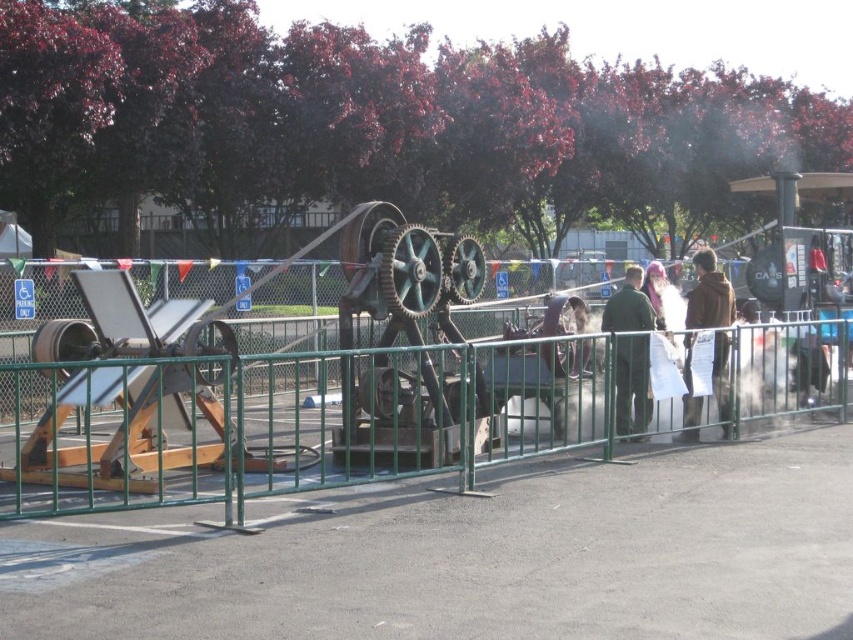
You are a photographer trying to capture a clear photo of the green matte jacket at center. However, the brown fuzzy coat at right is blocking your view. Can you move around to the left side to get an unobstructed shot?

The green matte jacket at center is behind the brown fuzzy coat at right, so moving to the left side might allow you to see around the brown fuzzy coat at right and capture the green matte jacket at center without obstruction.

You are a photographer trying to capture a clear photo of the green matte jacket at center without the brown fuzzy coat at right blocking it. Based on their positions, is this possible?

The brown fuzzy coat at right is below the green matte jacket at center, so you can take the photo from an angle where the green matte jacket at center is above and not blocked by the brown fuzzy coat at right.

Looking at this image, you are a photographer trying to capture a clear shot of the industrial machine through the fence. You notice two people nearby wearing the brown fuzzy coat at right and the green matte jacket at center. Which person should you ask to move so that their clothing does not block your view of the machine?

The brown fuzzy coat at right has a smaller size compared to the green matte jacket at center, so the person wearing the brown fuzzy coat at right is closer to the fence. Therefore, you should ask the person in the brown fuzzy coat at right to move to avoid blocking the view.